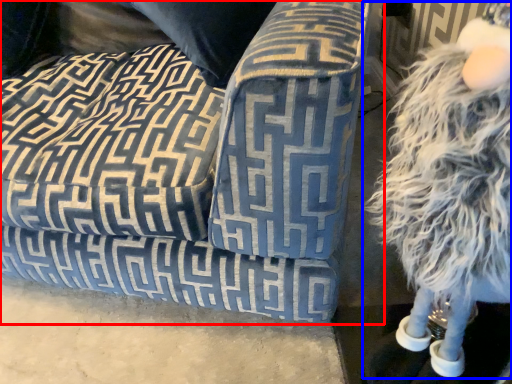
Question: Which object appears closest to the camera in this image, studio couch (highlighted by a red box) or figurine (highlighted by a blue box)?

Choices:
 (A) studio couch
 (B) figurine

Answer: (B)